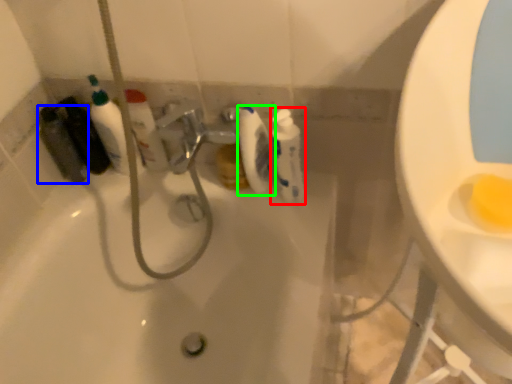
Question: Which object is the farthest from cleaning product (highlighted by a red box)? Choose among these: mouthwash (highlighted by a blue box) or toilet paper (highlighted by a green box).

Choices:
 (A) mouthwash
 (B) toilet paper

Answer: (A)